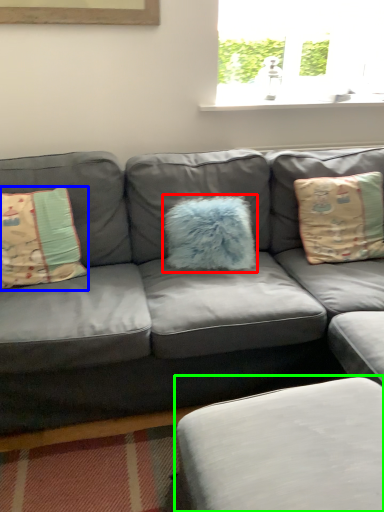
Question: Considering the real-world distances, which object is closest to pillow (highlighted by a red box)? pillow (highlighted by a blue box) or footrest (highlighted by a green box).

Choices:
 (A) pillow
 (B) footrest

Answer: (A)